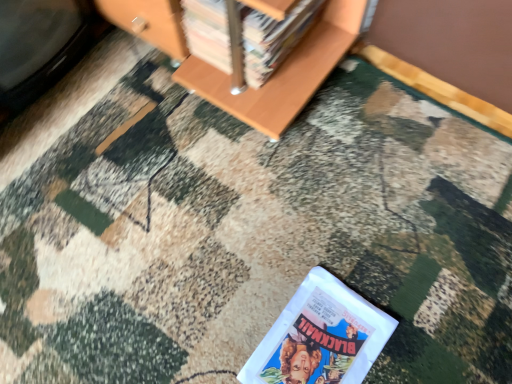
What are the coordinates of `vacant region to the left of white glossy book at lower center, the first book positioned from the bottom` in the screenshot? It's located at (216, 318).